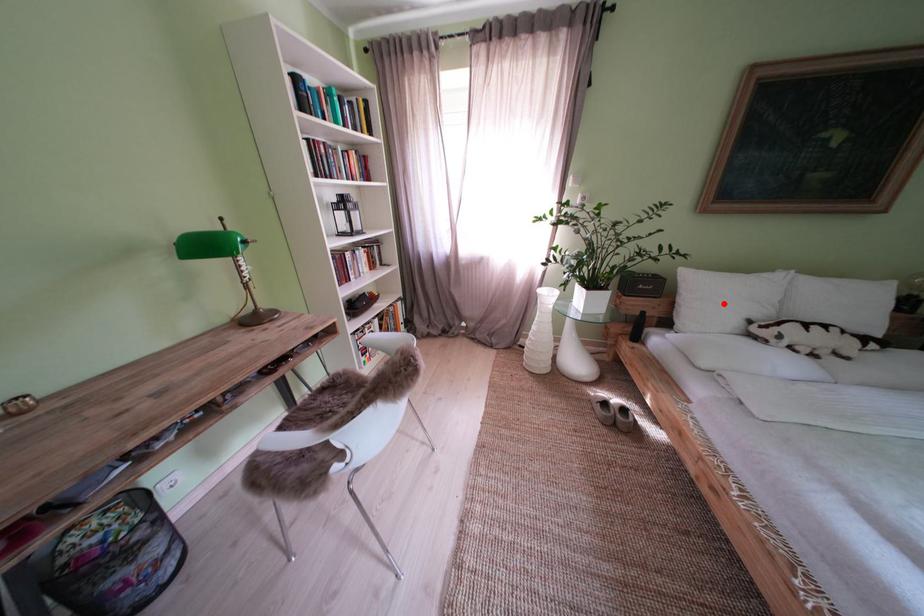
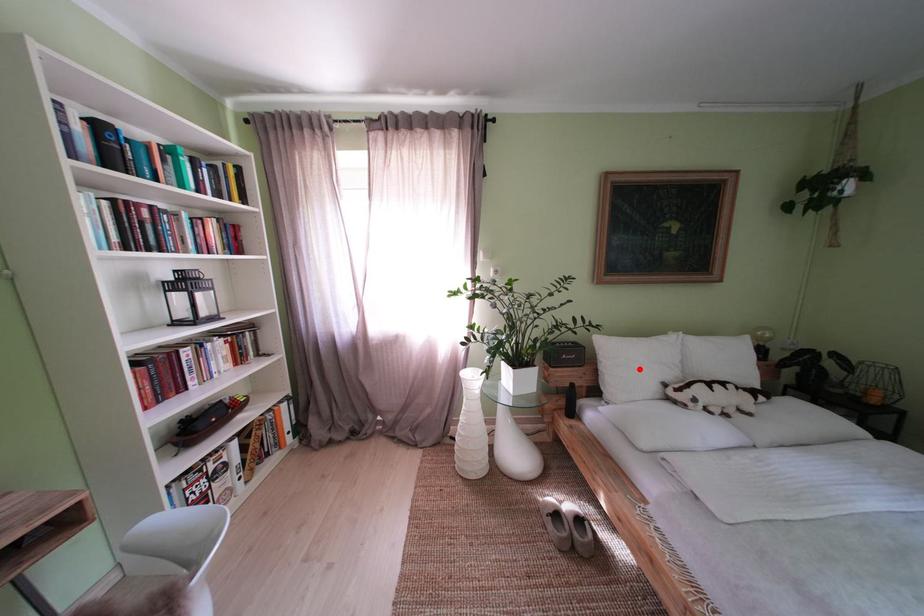
I am providing you with two images of the same scene from different viewpoints. A red point is marked on the first image and another point is marked on the second image. Is the red point in image1 aligned with the point shown in image2?

Yes